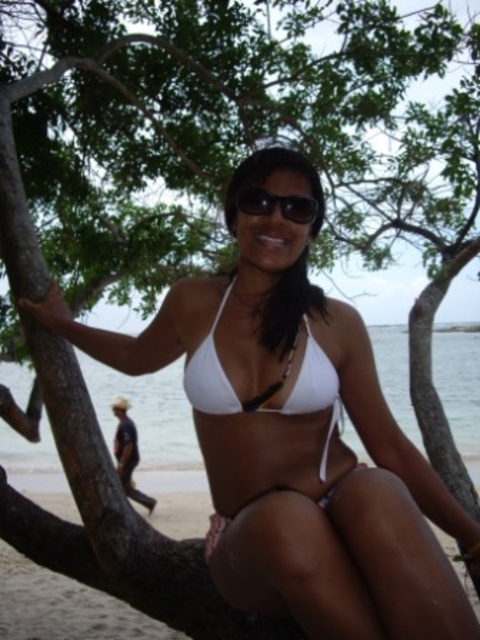
Consider the image. You are a photographer planning to take a photo of the woman in the scene. You want to ensure both the white matte bikini at center and the white matte bikini top at center are clearly visible. Which one should you focus on to ensure it appears larger in the photo?

The white matte bikini at center is larger in size than the white matte bikini top at center, so focusing on the white matte bikini at center will ensure it appears larger in the photo.

You are a photographer trying to capture the perfect shot of the woman on the tree branch. You notice the white fabric bikini bottom at lower center and the white matte bikini top at center. Which piece of clothing should you focus on if you want to capture the widest part of her outfit?

The white fabric bikini bottom at lower center is wider than the white matte bikini top at center, so focusing on the white fabric bikini bottom at lower center would capture the widest part of her outfit.

You are a photographer trying to capture the woman in the scene. You notice the white matte bikini at center and the black plastic sunglasses at center. Which object should you focus on first if you want to ensure both are in the frame?

The white matte bikini at center is much taller than the black plastic sunglasses at center, so focusing on the taller bikini first will ensure both are in the frame.